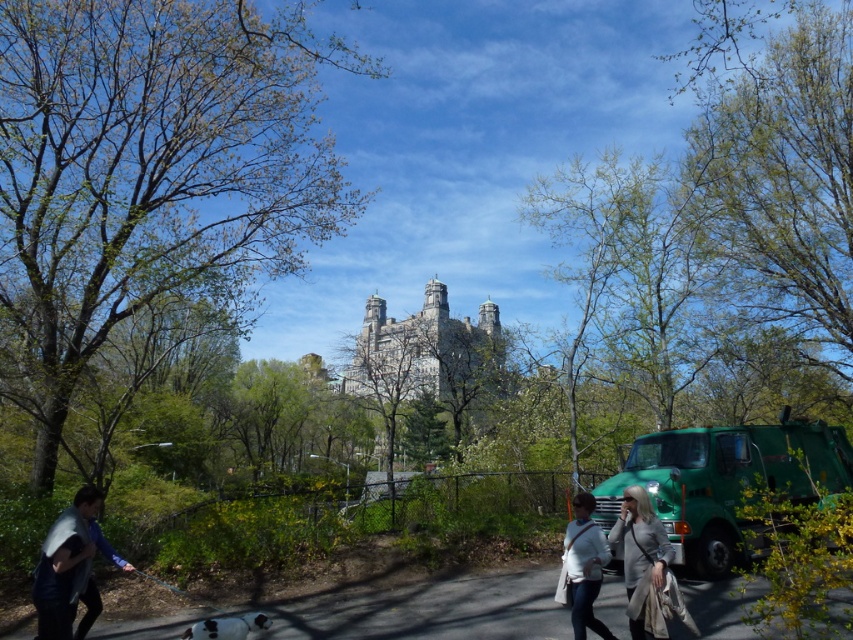
Question: Which point is farther to the camera?

Choices:
 (A) white fabric bag at lower center
 (B) green leafy tree at upper center
 (C) gray wool coat at lower right
 (D) smooth asphalt path at center

Answer: (B)

Question: Which of the following is the farthest from the observer?

Choices:
 (A) gray wool coat at lower right
 (B) denim jacket at lower left
 (C) smooth asphalt path at center

Answer: (A)

Question: Is green leafy tree at upper center closer to the viewer compared to green leafy tree at upper right?

Choices:
 (A) no
 (B) yes

Answer: (B)

Question: Is smooth asphalt path at center thinner than gray wool coat at lower right?

Choices:
 (A) yes
 (B) no

Answer: (B)

Question: Which object appears farthest from the camera in this image?

Choices:
 (A) green leafy tree at upper center
 (B) gray wool coat at lower right

Answer: (A)

Question: Does smooth asphalt path at center have a lesser width compared to denim jacket at lower left?

Choices:
 (A) yes
 (B) no

Answer: (B)